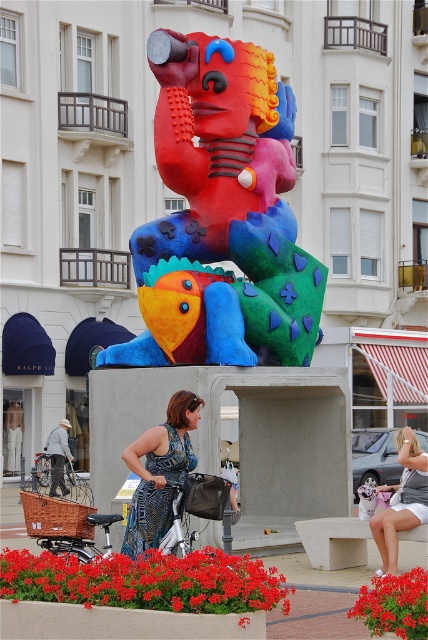
Between vivid red petals at center and blue textured dress at center, which one appears on the left side from the viewer's perspective?

From the viewer's perspective, blue textured dress at center appears more on the left side.

Who is more forward, (2, 563) or (175, 428)?

Point (2, 563) is more forward.

At what (x,y) coordinates should I click in order to perform the action: click on vivid red petals at center. Please return your answer as a coordinate pair (x, y). The width and height of the screenshot is (428, 640). Looking at the image, I should click on (145, 580).

Can you confirm if matte plastic sculpture at center is taller than blue textured dress at center?

Correct, matte plastic sculpture at center is much taller as blue textured dress at center.

Between matte plastic sculpture at center and blue textured dress at center, which one appears on the left side from the viewer's perspective?

From the viewer's perspective, blue textured dress at center appears more on the left side.

Is point (241, 250) farther from camera compared to point (157, 472)?

That is True.

You are a GUI agent. You are given a task and a screenshot of the screen. Output one action in this format:
    pyautogui.click(x=<x>, y=<y>)
    Task: Click on the matte plastic sculpture at center
    
    Given the screenshot: What is the action you would take?
    pyautogui.click(x=222, y=216)

Who is taller, blue textured dress at center or white cotton shorts at lower right?

Standing taller between the two is blue textured dress at center.

How distant is blue textured dress at center from white cotton shorts at lower right?

They are 5.02 meters apart.

Does point (163, 436) lie in front of point (395, 547)?

Yes, it is in front of point (395, 547).

Identify the location of blue textured dress at center. (160, 472).